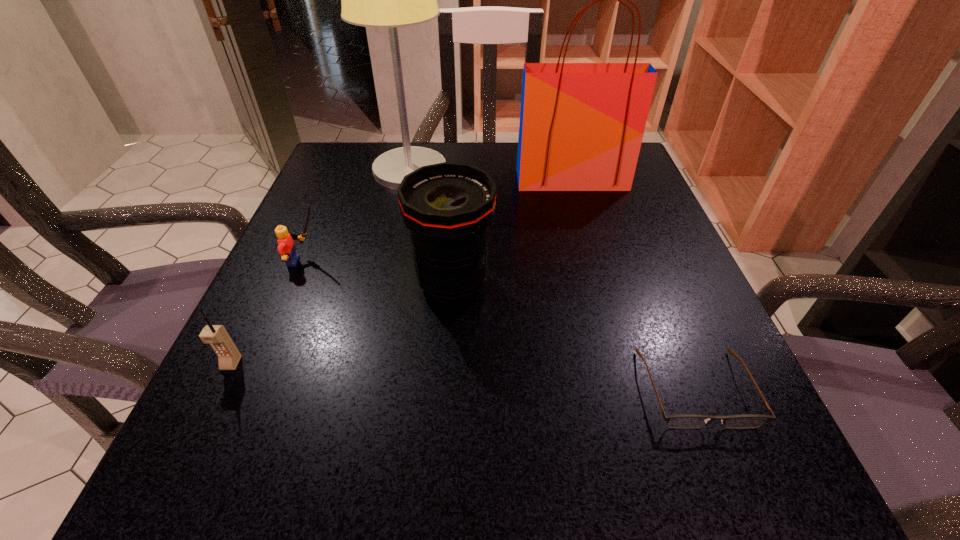
Where is `vacant region between the shopping bag and the table lamp`? vacant region between the shopping bag and the table lamp is located at coordinates (491, 175).

Locate an element on the screen. The height and width of the screenshot is (540, 960). vacant space that is in between the leftmost object and the table lamp is located at coordinates (321, 267).

This screenshot has height=540, width=960. Find the location of `free space between the fifth shortest object and the leftmost object`. free space between the fifth shortest object and the leftmost object is located at coordinates (401, 272).

Identify which object is the nearest to the shortest object. Please provide its 2D coordinates. Your answer should be formatted as a tuple, i.e. [(x, y)], where the tuple contains the x and y coordinates of a point satisfying the conditions above.

[(447, 207)]

Locate an element on the screen. This screenshot has width=960, height=540. object that stands as the closest to the Lego is located at coordinates (447, 207).